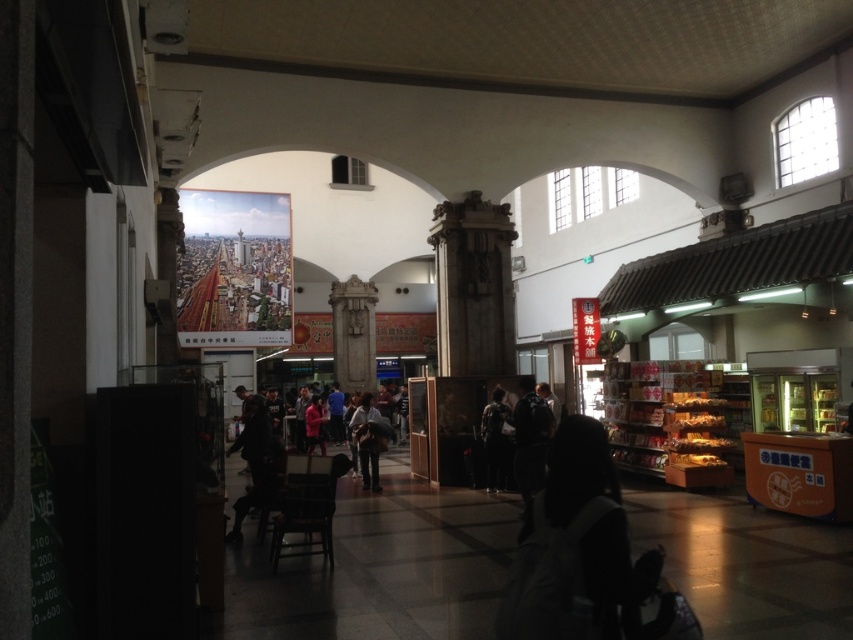
You are standing in the train station and see a dark blue jacket at center. If you want to reach it in 5 seconds, what is the minimum speed you need to walk towards it?

The dark blue jacket at center is 33.04 feet away from viewer. To reach it in 5 seconds, you need to walk at a minimum speed of 6.608 feet per second.